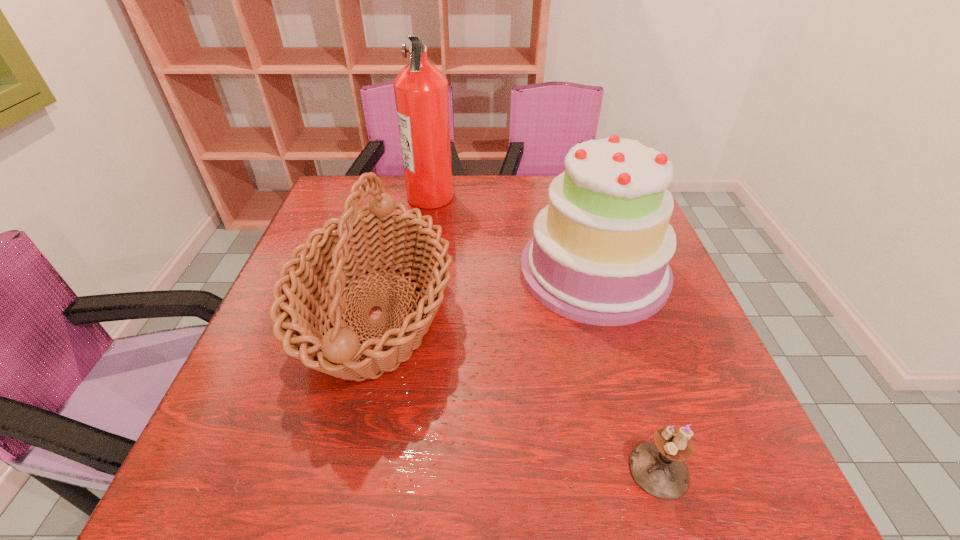
I want to click on free space that satisfies the following two spatial constraints: 1. at the nozzle of the cake; 2. on the right side of the tallest object, so click(x=419, y=271).